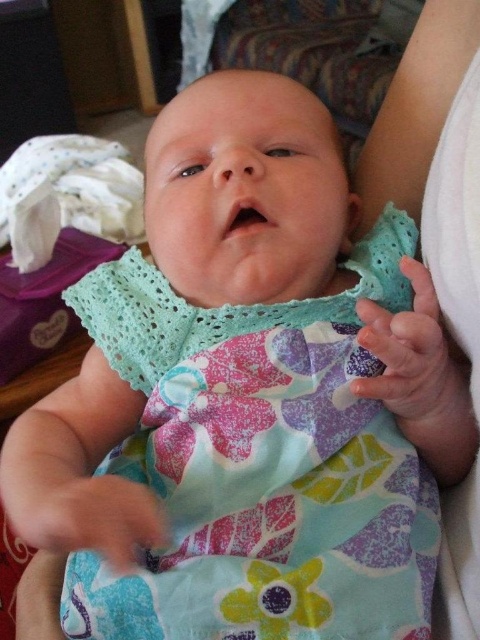
Question: Does white fabric at center appear on the left side of white soft cloth at left?

Choices:
 (A) no
 (B) yes

Answer: (A)

Question: Can you confirm if white fabric at center is bigger than white soft cloth at left?

Choices:
 (A) no
 (B) yes

Answer: (A)

Question: Which point appears farthest from the camera in this image?

Choices:
 (A) (470, 541)
 (B) (88, 184)

Answer: (B)

Question: Is white fabric at center to the left of white soft cloth at left from the viewer's perspective?

Choices:
 (A) no
 (B) yes

Answer: (A)